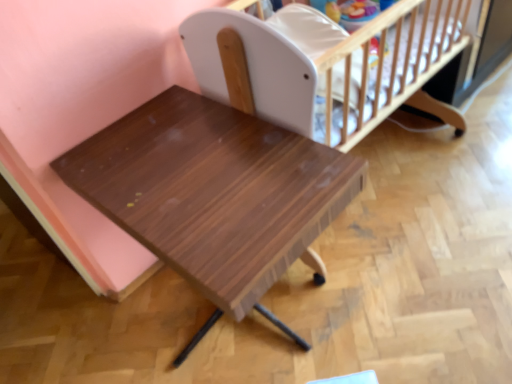
Locate an element on the screen. The image size is (512, 384). free point to the right of wooden table at center is located at coordinates (421, 287).